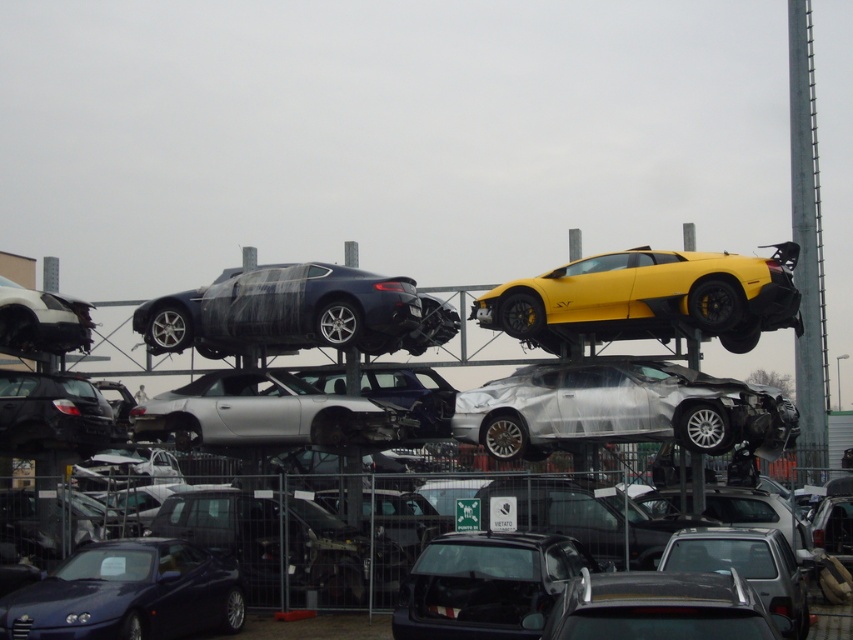
Describe the element at coordinates (312, 524) in the screenshot. The width and height of the screenshot is (853, 640). I see `matte black car at upper center` at that location.

Which is in front, point (633, 541) or point (173, 308)?

Point (633, 541)

The height and width of the screenshot is (640, 853). I want to click on matte black car at upper center, so click(x=312, y=524).

Is point (300, 504) positioned before point (595, 371)?

That is True.

Is matte black car at upper center shorter than silver/plastic wrap sports car at center?

No, matte black car at upper center is not shorter than silver/plastic wrap sports car at center.

Is point (213, 397) farther from camera compared to point (518, 410)?

Yes.

Find the location of a particular element. Image resolution: width=853 pixels, height=640 pixels. matte black car at upper center is located at coordinates (312, 524).

Between yellow matte sports car at upper right and satin black car at upper center, which one appears on the right side from the viewer's perspective?

yellow matte sports car at upper right

Can you confirm if yellow matte sports car at upper right is smaller than satin black car at upper center?

No, yellow matte sports car at upper right is not smaller than satin black car at upper center.

Measure the distance between point (705, 292) and camera.

The distance of point (705, 292) from camera is 22.82 meters.

The height and width of the screenshot is (640, 853). What are the coordinates of `yellow matte sports car at upper right` in the screenshot? It's located at (648, 300).